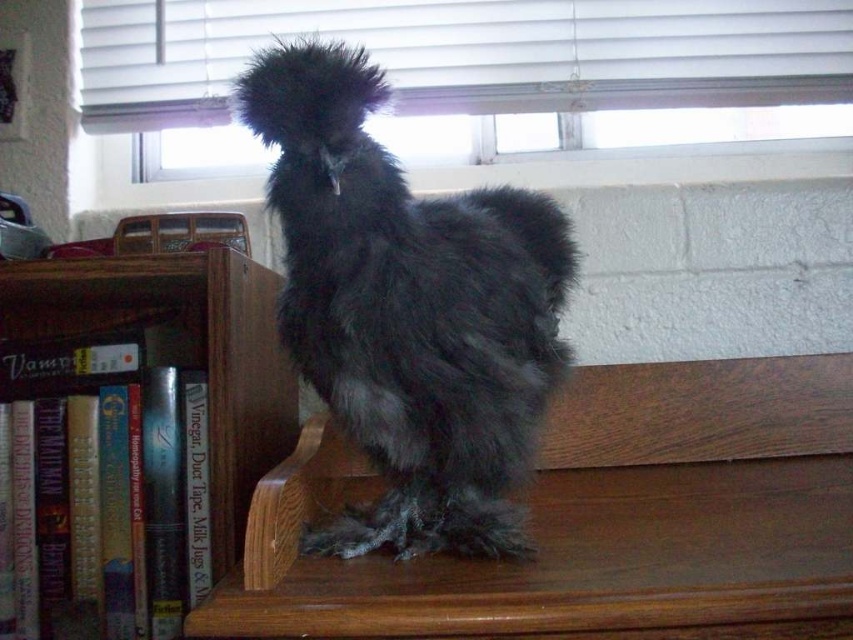
You are organizing a bookshelf and need to place a large decorative item that requires a wider surface. Based on the scene, which object between the brown wood shelf at center and the wooden bookcase at left should you choose?

The brown wood shelf at center has a larger width than the wooden bookcase at left, so you should choose the brown wood shelf at center for placing the large decorative item.